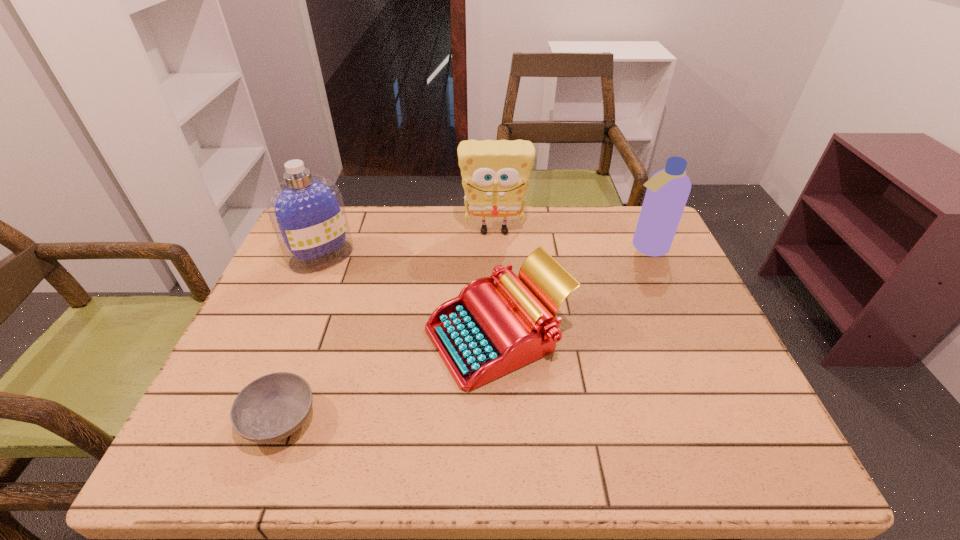
Locate an element on the screen. This screenshot has width=960, height=540. free space between the cleansing agent and the shortest object is located at coordinates (300, 338).

Where is `vacant region between the sponge and the bowl`? The height and width of the screenshot is (540, 960). vacant region between the sponge and the bowl is located at coordinates (388, 325).

The image size is (960, 540). I want to click on vacant space in between the bowl and the sponge, so click(x=388, y=325).

Locate an element on the screen. This screenshot has width=960, height=540. object that is the closest to the shortest object is located at coordinates (489, 330).

This screenshot has height=540, width=960. Identify the location of object that is the fourth closest to the cleansing agent. (667, 192).

Where is `free location that satisfies the following two spatial constraints: 1. on the back side of the rightmost object; 2. on the right side of the bowl`? The height and width of the screenshot is (540, 960). free location that satisfies the following two spatial constraints: 1. on the back side of the rightmost object; 2. on the right side of the bowl is located at coordinates (344, 247).

Find the location of `vacant position in the image that satisfies the following two spatial constraints: 1. on the face of the sponge; 2. on the right side of the shampoo`. vacant position in the image that satisfies the following two spatial constraints: 1. on the face of the sponge; 2. on the right side of the shampoo is located at coordinates (495, 247).

Locate an element on the screen. free location that satisfies the following two spatial constraints: 1. on the face of the sponge; 2. on the typing side of the second shortest object is located at coordinates (498, 336).